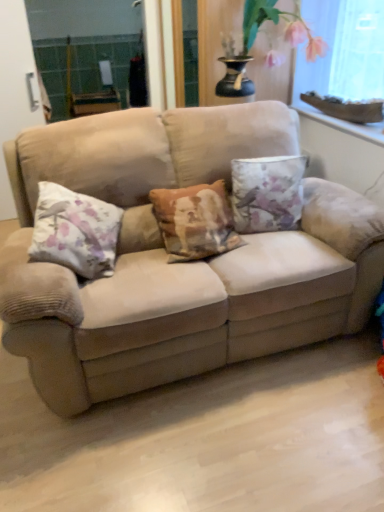
Question: Should I look upward or downward to see beige fabric couch at center?

Choices:
 (A) up
 (B) down

Answer: (A)

Question: Is the position of clear glass screen door at left less distant than that of floral fabric cushion at left, the second pillow viewed from the right?

Choices:
 (A) yes
 (B) no

Answer: (B)

Question: Can you confirm if clear glass screen door at left is positioned to the right of floral fabric cushion at left, the second pillow viewed from the right?

Choices:
 (A) yes
 (B) no

Answer: (B)

Question: Is clear glass screen door at left further to camera compared to floral fabric cushion at left, the second pillow viewed from the right?

Choices:
 (A) no
 (B) yes

Answer: (B)

Question: From the image's perspective, would you say clear glass screen door at left is shown under floral fabric cushion at left, the second pillow viewed from the right?

Choices:
 (A) no
 (B) yes

Answer: (A)

Question: From the image's perspective, is clear glass screen door at left located above floral fabric cushion at left, the second pillow viewed from the right?

Choices:
 (A) yes
 (B) no

Answer: (A)

Question: Considering the relative sizes of clear glass screen door at left and floral fabric cushion at left, the first pillow when ordered from left to right, in the image provided, is clear glass screen door at left taller than floral fabric cushion at left, the first pillow when ordered from left to right,?

Choices:
 (A) no
 (B) yes

Answer: (B)

Question: Is floral fabric cushion at left, the second pillow viewed from the right, turned away from white stone window sill at upper right?

Choices:
 (A) yes
 (B) no

Answer: (B)

Question: Is floral fabric cushion at left, the first pillow when ordered from left to right, to the right of white stone window sill at upper right from the viewer's perspective?

Choices:
 (A) no
 (B) yes

Answer: (A)

Question: Is floral fabric cushion at left, the first pillow when ordered from left to right, shorter than white stone window sill at upper right?

Choices:
 (A) no
 (B) yes

Answer: (A)

Question: Considering the relative sizes of floral fabric cushion at left, the first pillow when ordered from left to right, and white stone window sill at upper right in the image provided, is floral fabric cushion at left, the first pillow when ordered from left to right, taller than white stone window sill at upper right?

Choices:
 (A) yes
 (B) no

Answer: (A)

Question: Is floral fabric cushion at left, the second pillow viewed from the right, beside white stone window sill at upper right?

Choices:
 (A) yes
 (B) no

Answer: (B)

Question: Is floral fabric cushion at left, the first pillow when ordered from left to right, bigger than white stone window sill at upper right?

Choices:
 (A) yes
 (B) no

Answer: (A)

Question: From a real-world perspective, is floral fabric cushion at left, the first pillow when ordered from left to right, on beige fabric couch at center?

Choices:
 (A) yes
 (B) no

Answer: (A)